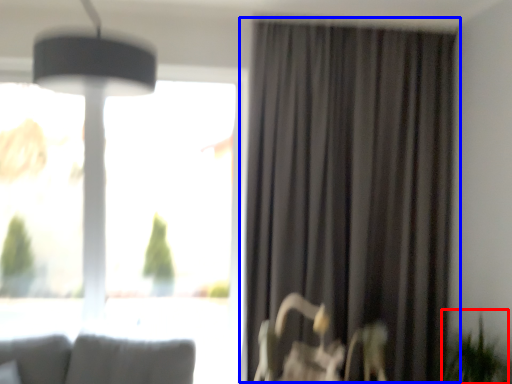
Question: Which object is closer to the camera taking this photo, plant (highlighted by a red box) or curtain (highlighted by a blue box)?

Choices:
 (A) plant
 (B) curtain

Answer: (A)